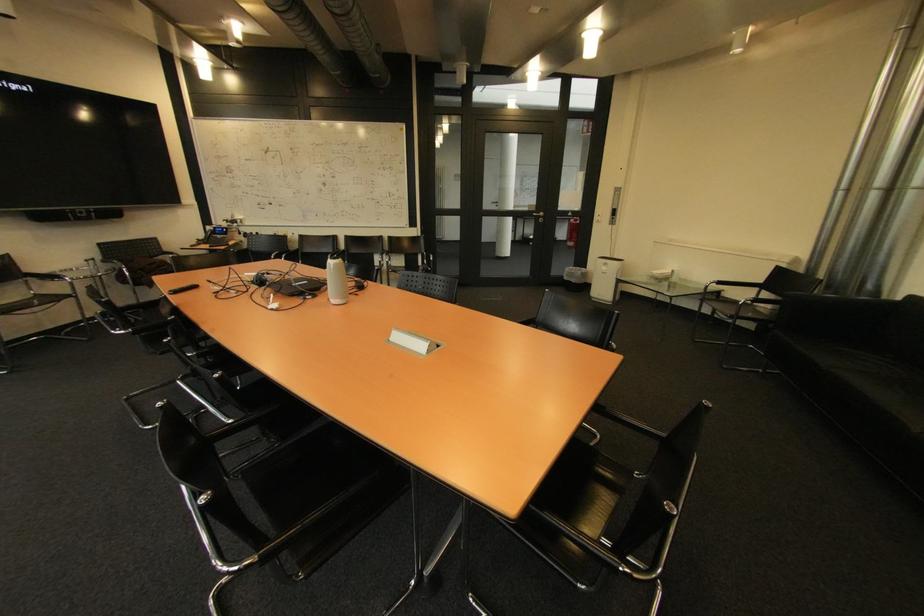
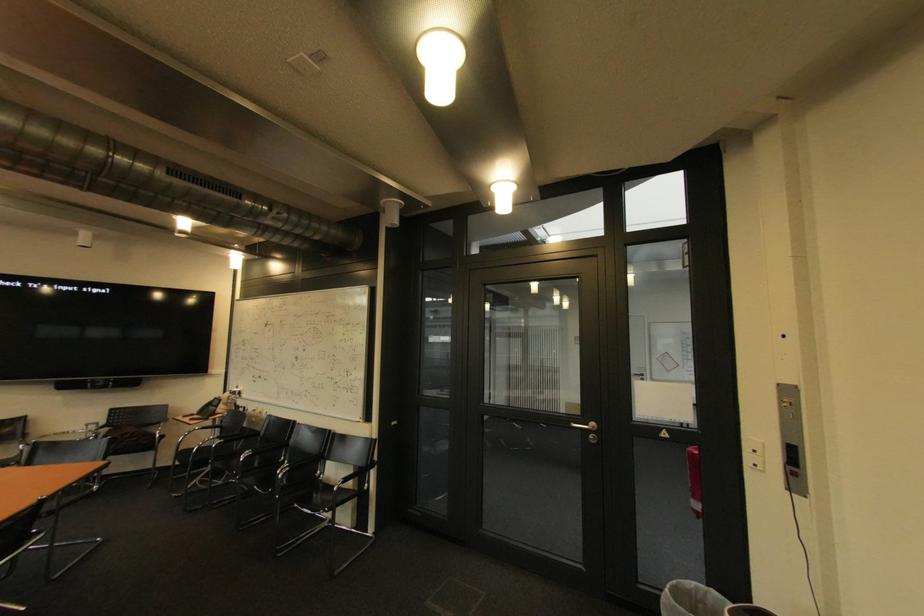
Question: I am providing you with two images of the same scene from different viewpoints. Please identify which objects are invisible in image2.

Choices:
 (A) red fire extinguisher
 (B) black chair sitting surface
 (C) black phone handset
 (D) none of these

Answer: (D)